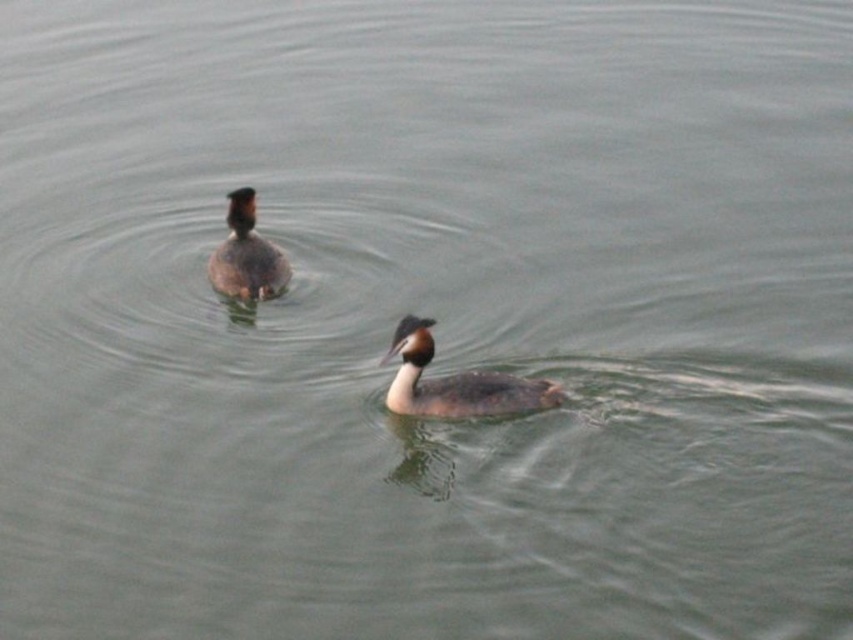
You are a wildlife photographer aiming to capture both the brown matte duck at center and the brown speckled duck at upper center in a single frame. Based on their positions, which duck is positioned to the left of the other?

The brown speckled duck at upper center is to the left of the brown matte duck at center.

You are observing two points in the image of the birds swimming on the water. Which point, point (550, 392) or point (230, 216), is nearer to you?

Point (550, 392) is closer to the viewer than point (230, 216).

You are a wildlife photographer aiming to capture a closeup of both the brown matte duck at center and the brown speckled duck at upper center. Given their sizes, which duck should you focus on first to ensure you can frame them properly in your shot?

The brown matte duck at center is larger in size compared to the brown speckled duck at upper center. To frame them properly, focus on the larger brown matte duck at center first to accommodate its size, then adjust the frame to include the smaller brown speckled duck at upper center.